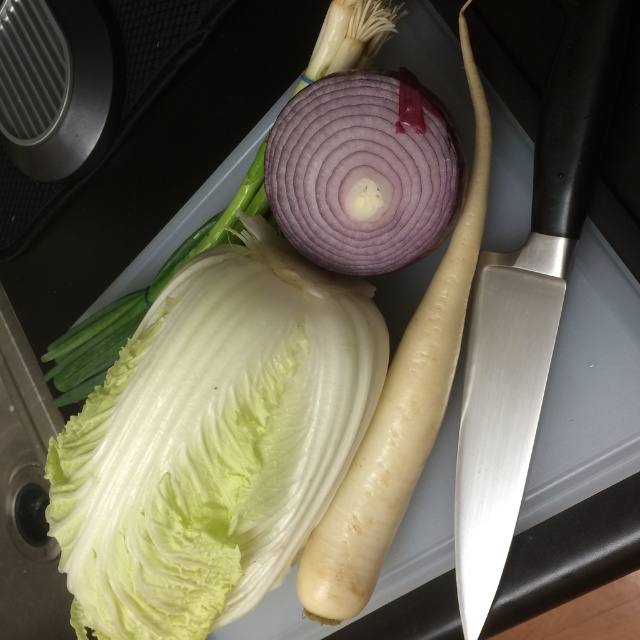
You are a chef preparing a dish and need to choose between the purple matte onion at center and the purple smooth onion at center. Which one has a larger diameter?

The purple matte onion at center might be wider than purple smooth onion at center, so it has a larger diameter.

You are a chef preparing a dish and need to locate the white crisp lettuce at center. According to the image, what are the exact coordinates of its position?

The white crisp lettuce at center is located at the coordinates point (212, 440).